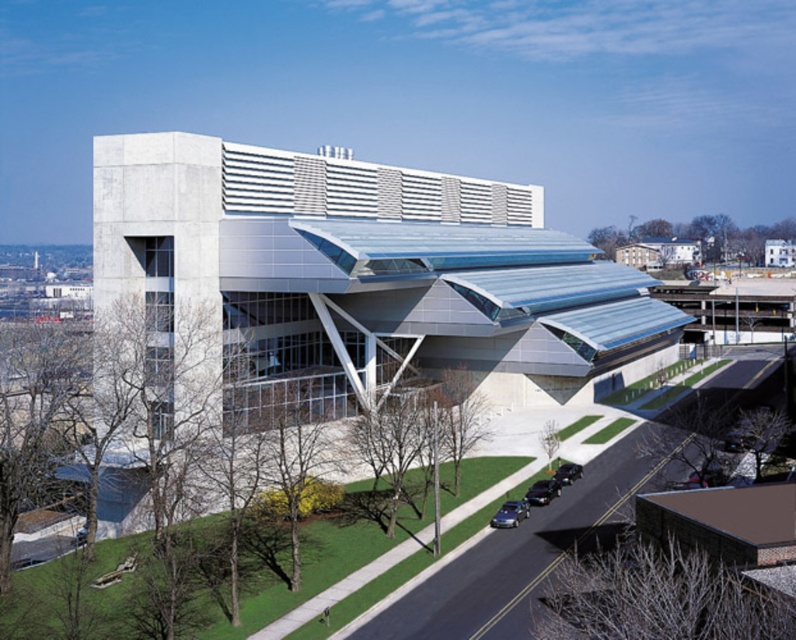
Who is higher up, shiny black sedan at lower center or shiny black car at lower center?

shiny black car at lower center

You are a GUI agent. You are given a task and a screenshot of the screen. Output one action in this format:
    pyautogui.click(x=<x>, y=<y>)
    Task: Click on the shiny black sedan at lower center
    The image size is (796, 640).
    Given the screenshot: What is the action you would take?
    pyautogui.click(x=541, y=492)

Locate an element on the screen. The image size is (796, 640). shiny black sedan at lower center is located at coordinates 541,492.

Measure the distance between point (123, 285) and camera.

A distance of 72.38 meters exists between point (123, 285) and camera.

How much distance is there between white metallic building at center and shiny blue sedan at lower center?

white metallic building at center and shiny blue sedan at lower center are 47.60 meters apart from each other.

Does point (592, 250) come closer to viewer compared to point (502, 522)?

That is False.

At what (x,y) coordinates should I click in order to perform the action: click on white metallic building at center. Please return your answer as a coordinate pair (x, y). This screenshot has width=796, height=640. Looking at the image, I should click on (365, 275).

Between point (510, 518) and point (551, 483), which one is positioned in front?

Point (510, 518) is more forward.

What do you see at coordinates (510, 513) in the screenshot? This screenshot has width=796, height=640. I see `shiny blue sedan at lower center` at bounding box center [510, 513].

Is point (500, 518) positioned before point (535, 502)?

Yes, point (500, 518) is closer to viewer.

Image resolution: width=796 pixels, height=640 pixels. I want to click on shiny blue sedan at lower center, so click(510, 513).